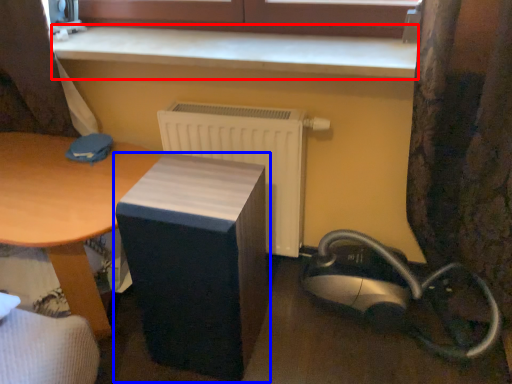
Question: Which of the following is the farthest to the observer, counter top (highlighted by a red box) or furniture (highlighted by a blue box)?

Choices:
 (A) counter top
 (B) furniture

Answer: (A)